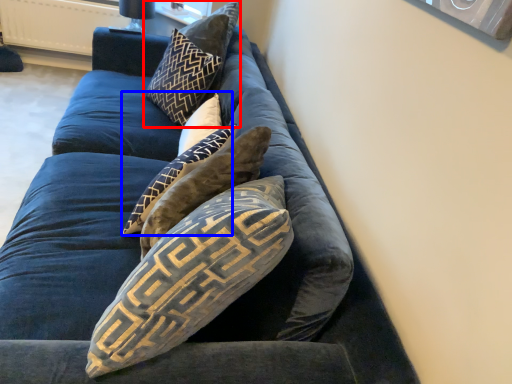
Question: Which of the following is the farthest to the observer, pillow (highlighted by a red box) or pillow (highlighted by a blue box)?

Choices:
 (A) pillow
 (B) pillow

Answer: (A)